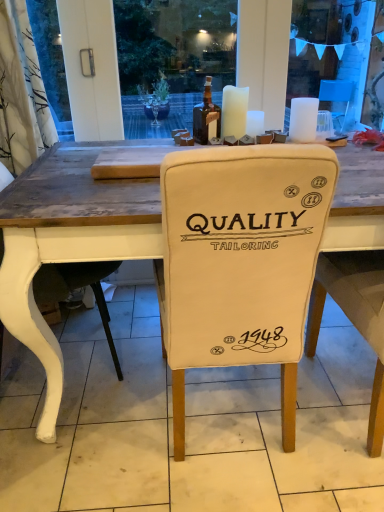
Question: Considering the relative sizes of white wax candle at center, acting as the second candle starting from the right, and white matte candle at upper center, which is the first candle from left to right, in the image provided, is white wax candle at center, acting as the second candle starting from the right, thinner than white matte candle at upper center, which is the first candle from left to right,?

Choices:
 (A) no
 (B) yes

Answer: (B)

Question: Is white wax candle at center, acting as the second candle starting from the right, at the right side of white matte candle at upper center, which is the first candle from left to right?

Choices:
 (A) yes
 (B) no

Answer: (A)

Question: From the image's perspective, is white wax candle at center, acting as the second candle starting from the right, on top of white matte candle at upper center, which is the first candle from left to right?

Choices:
 (A) yes
 (B) no

Answer: (B)

Question: Is white wax candle at center, acting as the second candle starting from the right, outside of white matte candle at upper center, the 3th candle when ordered from right to left?

Choices:
 (A) no
 (B) yes

Answer: (B)

Question: Can you confirm if white wax candle at center, acting as the second candle starting from the right, is shorter than white matte candle at upper center, the 3th candle when ordered from right to left?

Choices:
 (A) yes
 (B) no

Answer: (A)

Question: Considering the positions of point (99, 328) and point (304, 111), is point (99, 328) closer or farther from the camera than point (304, 111)?

Choices:
 (A) closer
 (B) farther

Answer: (B)

Question: Is white fabric chair cover at center wider or thinner than white matte candle at upper center, acting as the 3th candle starting from the left?

Choices:
 (A) wide
 (B) thin

Answer: (A)

Question: Considering the relative positions of white fabric chair cover at center and white matte candle at upper center, acting as the 3th candle starting from the left, in the image provided, is white fabric chair cover at center to the left or to the right of white matte candle at upper center, acting as the 3th candle starting from the left,?

Choices:
 (A) right
 (B) left

Answer: (B)

Question: Is white fabric chair cover at center taller or shorter than white matte candle at upper center, which appears as the 1th candle when viewed from the right?

Choices:
 (A) short
 (B) tall

Answer: (A)

Question: From a real-world perspective, is white fabric chair at left above or below white matte candle at upper center, acting as the 3th candle starting from the left?

Choices:
 (A) above
 (B) below

Answer: (B)

Question: In terms of width, does white fabric chair at left look wider or thinner when compared to white matte candle at upper center, acting as the 3th candle starting from the left?

Choices:
 (A) thin
 (B) wide

Answer: (B)

Question: Is white fabric chair at left taller or shorter than white matte candle at upper center, acting as the 3th candle starting from the left?

Choices:
 (A) tall
 (B) short

Answer: (A)

Question: From the image's perspective, is white fabric chair at left positioned above or below white matte candle at upper center, which appears as the 1th candle when viewed from the right?

Choices:
 (A) below
 (B) above

Answer: (A)

Question: Choose the correct answer: Is white matte candle at upper center, the 3th candle when ordered from right to left, inside white fabric chair at center or outside it?

Choices:
 (A) inside
 (B) outside

Answer: (B)

Question: Based on their sizes in the image, would you say white matte candle at upper center, the 3th candle when ordered from right to left, is bigger or smaller than white fabric chair at center?

Choices:
 (A) small
 (B) big

Answer: (A)